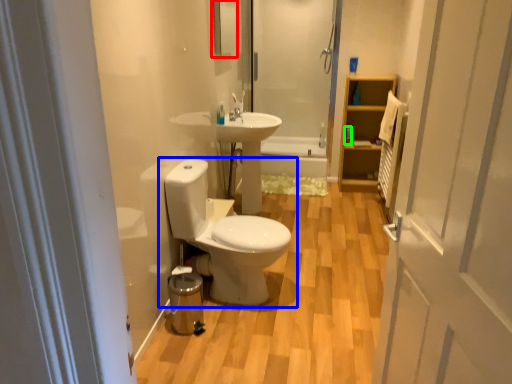
Question: Which object is the closest to the mirror (highlighted by a red box)? Choose among these: toilet (highlighted by a blue box) or toiletry (highlighted by a green box).

Choices:
 (A) toilet
 (B) toiletry

Answer: (A)